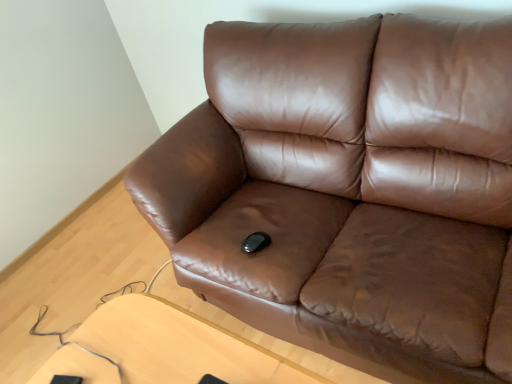
Describe the element at coordinates (350, 191) in the screenshot. I see `brown leather couch at center` at that location.

The width and height of the screenshot is (512, 384). I want to click on brown leather couch at center, so click(x=350, y=191).

Image resolution: width=512 pixels, height=384 pixels. Describe the element at coordinates (163, 349) in the screenshot. I see `light brown wooden table at lower center` at that location.

I want to click on light brown wooden table at lower center, so click(163, 349).

What is the approximate width of light brown wooden table at lower center?

light brown wooden table at lower center is 35.11 centimeters wide.

Identify the location of brown leather couch at center. The image size is (512, 384). (350, 191).

Which is more to the left, brown leather couch at center or light brown wooden table at lower center?

light brown wooden table at lower center.

Looking at this image, does brown leather couch at center come in front of light brown wooden table at lower center?

Yes, brown leather couch at center is in front of light brown wooden table at lower center.

Is point (342, 179) positioned before point (163, 360)?

No, (342, 179) is further to viewer.

From the image's perspective, is brown leather couch at center above light brown wooden table at lower center?

Yes, from the image's perspective, brown leather couch at center is over light brown wooden table at lower center.

From a real-world perspective, is brown leather couch at center above or below light brown wooden table at lower center?

Clearly, from a real-world perspective, brown leather couch at center is above light brown wooden table at lower center.

Considering the relative sizes of brown leather couch at center and light brown wooden table at lower center in the image provided, is brown leather couch at center wider than light brown wooden table at lower center?

Yes, brown leather couch at center is wider than light brown wooden table at lower center.

Which of these two, brown leather couch at center or light brown wooden table at lower center, stands taller?

brown leather couch at center.

Between brown leather couch at center and light brown wooden table at lower center, which one has larger size?

Bigger between the two is brown leather couch at center.

Would you say brown leather couch at center is outside light brown wooden table at lower center?

brown leather couch at center lies outside light brown wooden table at lower center's area.

Is brown leather couch at center not close to light brown wooden table at lower center?

No, there isn't a large distance between brown leather couch at center and light brown wooden table at lower center.

Could you tell me if brown leather couch at center is facing light brown wooden table at lower center?

Yes.

What's the angular difference between brown leather couch at center and light brown wooden table at lower center's facing directions?

There is a 1.08-degree angle between the facing directions of brown leather couch at center and light brown wooden table at lower center.

How distant is brown leather couch at center from light brown wooden table at lower center?

brown leather couch at center is 24.51 inches away from light brown wooden table at lower center.

At what (x,y) coordinates should I click in order to perform the action: click on table below the brown leather couch at center (from the image's perspective). Please return your answer as a coordinate pair (x, y). This screenshot has height=384, width=512. Looking at the image, I should click on (163, 349).

Would you say light brown wooden table at lower center is to the left or to the right of brown leather couch at center in the picture?

Clearly, light brown wooden table at lower center is on the left of brown leather couch at center in the image.

Which object is further away from the camera, light brown wooden table at lower center or brown leather couch at center?

light brown wooden table at lower center.

Does point (121, 377) come behind point (364, 78)?

No, (121, 377) is in front of (364, 78).

From the image's perspective, is light brown wooden table at lower center located beneath brown leather couch at center?

Yes, from the image's perspective, light brown wooden table at lower center is beneath brown leather couch at center.

From a real-world perspective, who is located lower, light brown wooden table at lower center or brown leather couch at center?

From a 3D spatial view, light brown wooden table at lower center is below.

Considering the relative sizes of light brown wooden table at lower center and brown leather couch at center in the image provided, is light brown wooden table at lower center thinner than brown leather couch at center?

Yes, light brown wooden table at lower center is thinner than brown leather couch at center.

Who is shorter, light brown wooden table at lower center or brown leather couch at center?

light brown wooden table at lower center is shorter.

Considering the relative sizes of light brown wooden table at lower center and brown leather couch at center in the image provided, is light brown wooden table at lower center smaller than brown leather couch at center?

Indeed, light brown wooden table at lower center has a smaller size compared to brown leather couch at center.

Is brown leather couch at center inside light brown wooden table at lower center?

No, brown leather couch at center is not a part of light brown wooden table at lower center.

Is light brown wooden table at lower center not near brown leather couch at center?

No, light brown wooden table at lower center is in close proximity to brown leather couch at center.

Does light brown wooden table at lower center turn towards brown leather couch at center?

No.

Image resolution: width=512 pixels, height=384 pixels. Find the location of `studio couch above the light brown wooden table at lower center (from a real-world perspective)`. studio couch above the light brown wooden table at lower center (from a real-world perspective) is located at coordinates (350, 191).

At what (x,y) coordinates should I click in order to perform the action: click on studio couch on the right of light brown wooden table at lower center. Please return your answer as a coordinate pair (x, y). This screenshot has width=512, height=384. Looking at the image, I should click on (350, 191).

Identify the location of studio couch in front of the light brown wooden table at lower center. (350, 191).